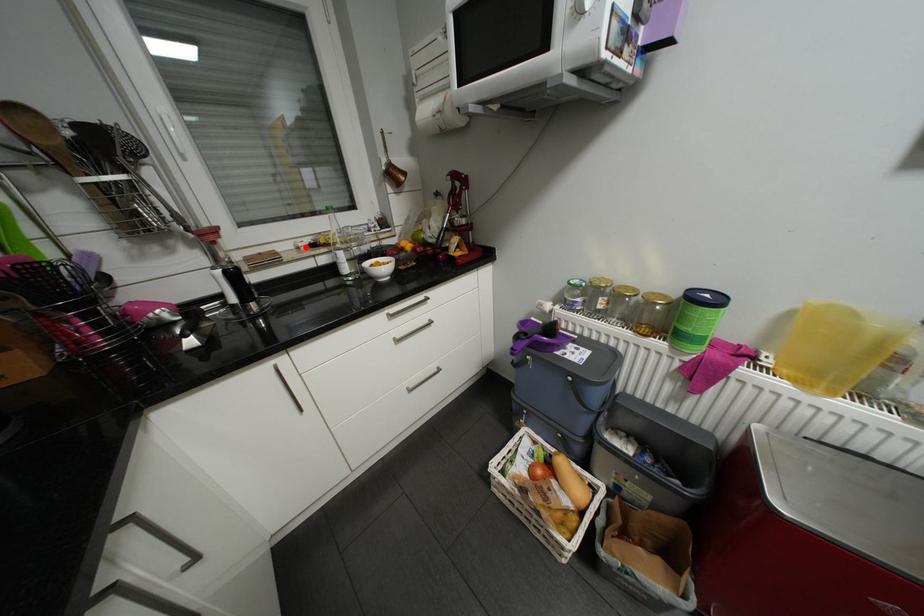
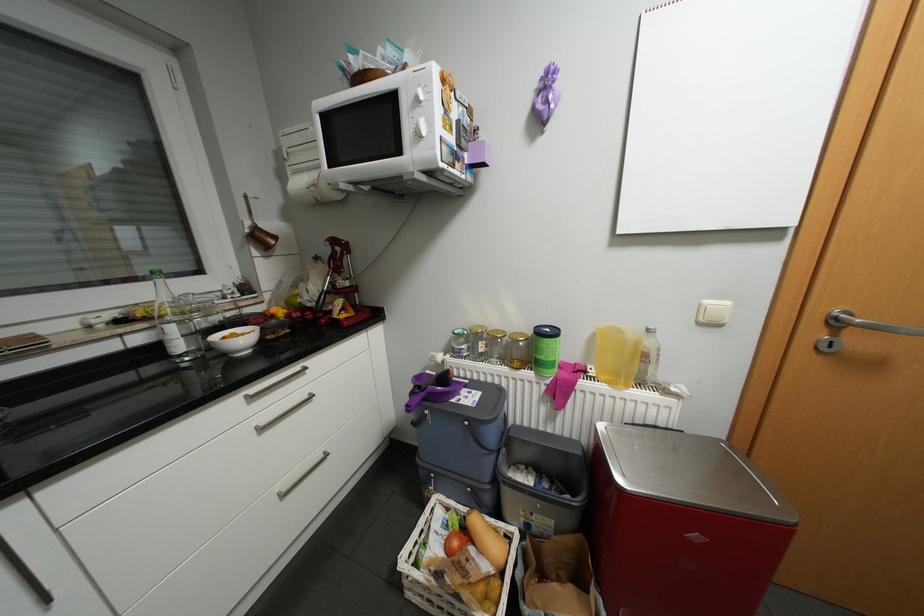
In the second image, find the point that corresponds to the highlighted location in the first image.

(96, 326)